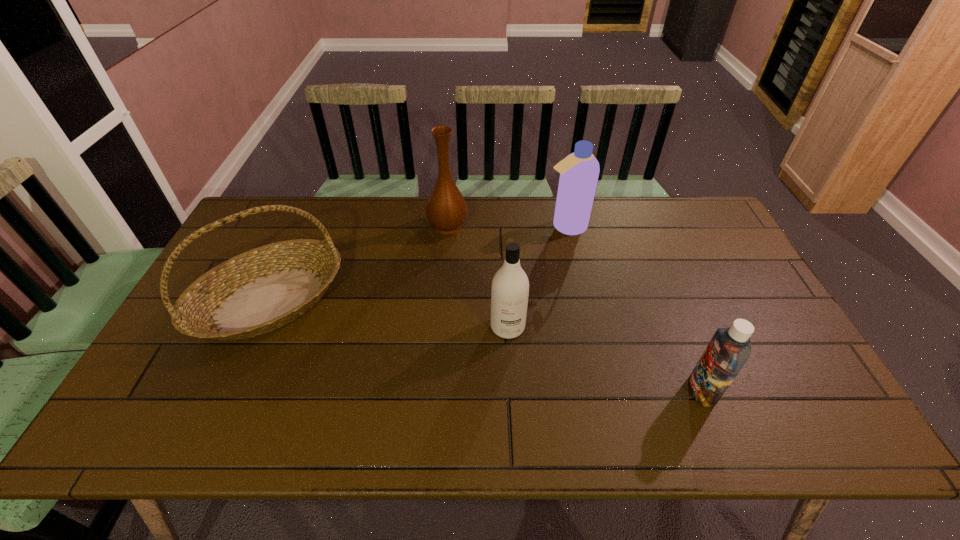
This screenshot has width=960, height=540. Find the location of `free space located 0.070m on the right of the leftmost object`. free space located 0.070m on the right of the leftmost object is located at coordinates (365, 301).

At what (x,y) coordinates should I click in order to perform the action: click on free spot located on the front-facing side of the leftmost shampoo. Please return your answer as a coordinate pair (x, y). Looking at the image, I should click on (514, 433).

The image size is (960, 540). In order to click on vacant space situated 0.120m on the front label of the shortest object in this screenshot , I will do `click(639, 391)`.

Locate an element on the screen. vacant point located on the front label of the shortest object is located at coordinates (585, 391).

Locate an element on the screen. This screenshot has height=540, width=960. free location located on the front label of the shortest object is located at coordinates (622, 391).

This screenshot has height=540, width=960. Find the location of `vase that is at the far edge`. vase that is at the far edge is located at coordinates (446, 210).

Identify the location of shampoo that is at the far edge. (579, 171).

Where is `object positioned at the near edge`? The image size is (960, 540). object positioned at the near edge is located at coordinates (729, 349).

In order to click on object at the left edge in this screenshot , I will do `click(258, 291)`.

Image resolution: width=960 pixels, height=540 pixels. What are the coordinates of `vacant point at the far edge` in the screenshot? It's located at (332, 232).